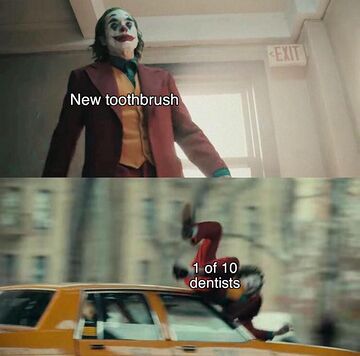
In order to click on window in this screenshot , I will do `click(219, 126)`.